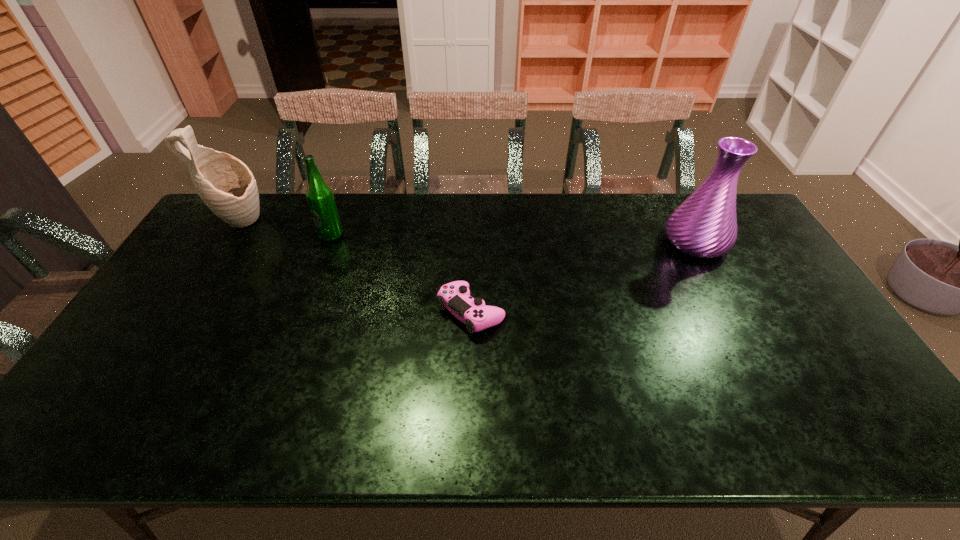
Identify the location of pitcher. This screenshot has height=540, width=960. (225, 184).

Find the location of `the rightmost object`. the rightmost object is located at coordinates (705, 225).

Where is `the second shortest object`? Image resolution: width=960 pixels, height=540 pixels. the second shortest object is located at coordinates (319, 196).

You are a GUI agent. You are given a task and a screenshot of the screen. Output one action in this format:
    pyautogui.click(x=<x>, y=<y>)
    Task: Click on the second object from left to right
    This screenshot has height=540, width=960.
    Given the screenshot: What is the action you would take?
    pyautogui.click(x=319, y=196)

Locate an element on the screen. The image size is (960, 540). control is located at coordinates (455, 296).

Locate an element on the screen. the nearest object is located at coordinates (455, 296).

Where is `free space located 0.380m at the spout of the leftmost object`? Image resolution: width=960 pixels, height=540 pixels. free space located 0.380m at the spout of the leftmost object is located at coordinates (377, 222).

You are a GUI agent. You are given a task and a screenshot of the screen. Output one action in this format:
    pyautogui.click(x=<x>, y=<y>)
    Task: Click on the free space located on the front of the rightmost object
    
    Given the screenshot: What is the action you would take?
    pyautogui.click(x=750, y=344)

This screenshot has width=960, height=540. In order to click on vacant space positioned on the label of the beer bottle in this screenshot , I will do `click(299, 324)`.

The width and height of the screenshot is (960, 540). I want to click on vacant space located on the front of the shortest object, so click(x=468, y=440).